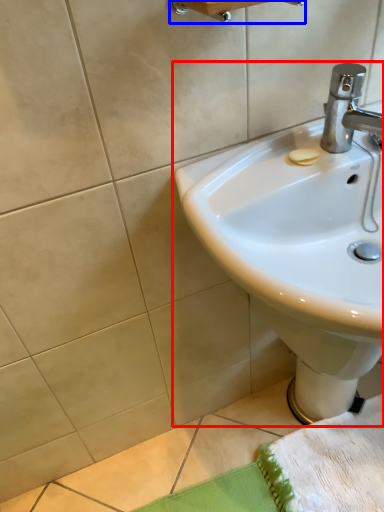
Question: Which object is closer to the camera taking this photo, sink (highlighted by a red box) or towel bar (highlighted by a blue box)?

Choices:
 (A) sink
 (B) towel bar

Answer: (A)